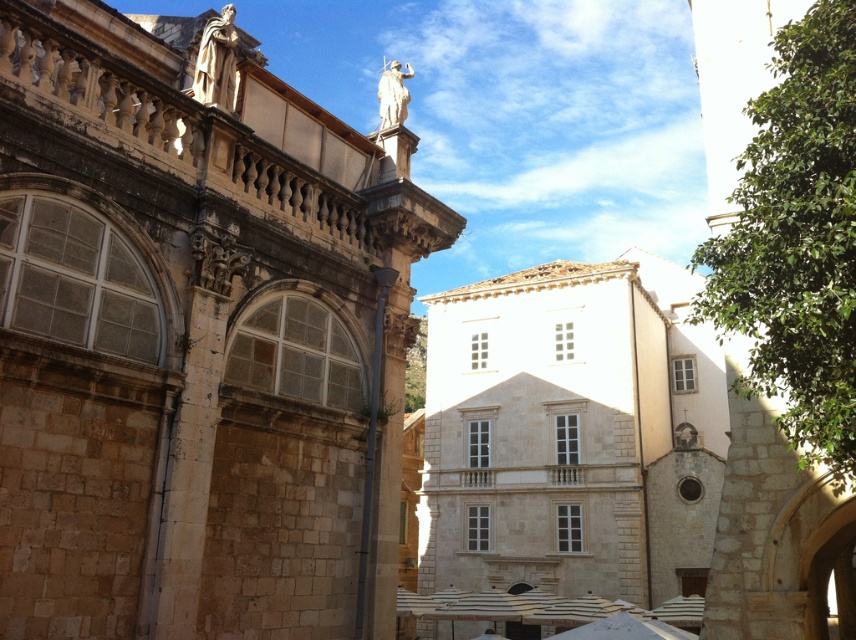
Can you confirm if white marble statue at upper left is wider than white marble statue at upper center?

No, white marble statue at upper left is not wider than white marble statue at upper center.

Image resolution: width=856 pixels, height=640 pixels. I want to click on white marble statue at upper left, so click(x=217, y=61).

Between point (233, 16) and point (401, 92), which one is positioned behind?

Positioned behind is point (401, 92).

At what (x,y) coordinates should I click in order to perform the action: click on white marble statue at upper left. Please return your answer as a coordinate pair (x, y). Looking at the image, I should click on (217, 61).